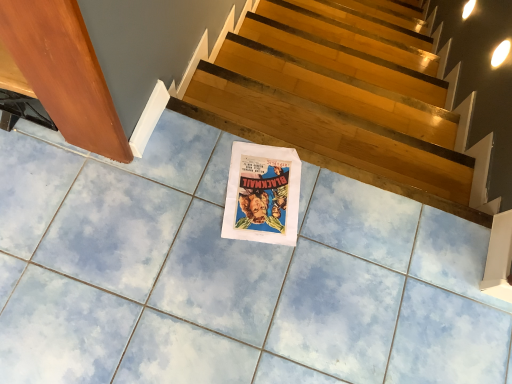
This screenshot has width=512, height=384. What do you see at coordinates (341, 96) in the screenshot? I see `wooden at upper center` at bounding box center [341, 96].

This screenshot has width=512, height=384. In order to click on wooden at upper center in this screenshot , I will do `click(341, 96)`.

At what (x,y) coordinates should I click in order to perform the action: click on white paper at center. Please return your answer as a coordinate pair (x, y). The image size is (512, 384). Looking at the image, I should click on (262, 194).

Measure the distance between point [289,227] and camera.

Point [289,227] is 1.19 meters away from camera.

What do you see at coordinates (262, 194) in the screenshot?
I see `white paper at center` at bounding box center [262, 194].

Locate an element on the screen. wooden at upper center is located at coordinates (341, 96).

Based on their positions, is white paper at center located to the left or right of wooden at upper center?

In the image, white paper at center appears on the left side of wooden at upper center.

Is white paper at center further to camera compared to wooden at upper center?

No, white paper at center is closer to the camera.

Which point is more distant from viewer, (247, 208) or (457, 114)?

The point (457, 114) is behind.

From the image's perspective, is white paper at center above wooden at upper center?

No, from the image's perspective, white paper at center is not on top of wooden at upper center.

From a real-world perspective, which is physically below, white paper at center or wooden at upper center?

wooden at upper center, from a real-world perspective.

Considering the relative sizes of white paper at center and wooden at upper center in the image provided, is white paper at center thinner than wooden at upper center?

No, white paper at center is not thinner than wooden at upper center.

Considering the sizes of white paper at center and wooden at upper center in the image, is white paper at center taller or shorter than wooden at upper center?

Clearly, white paper at center is shorter compared to wooden at upper center.

In the scene shown: Considering the relative sizes of white paper at center and wooden at upper center in the image provided, is white paper at center smaller than wooden at upper center?

Yes.

Is wooden at upper center located within white paper at center?

No, wooden at upper center is located outside of white paper at center.

Is white paper at center beside wooden at upper center?

No, white paper at center is not beside wooden at upper center.

Is white paper at center turned away from wooden at upper center?

white paper at center is not turned away from wooden at upper center.

From the picture: What's the angular difference between white paper at center and wooden at upper center's facing directions?

There is a 14.6-degree angle between the facing directions of white paper at center and wooden at upper center.

Where is `stairs that is under the white paper at center (from a real-world perspective)`? stairs that is under the white paper at center (from a real-world perspective) is located at coordinates (341, 96).

Does wooden at upper center appear on the right side of white paper at center?

Correct, you'll find wooden at upper center to the right of white paper at center.

Relative to white paper at center, is wooden at upper center in front or behind?

Visually, wooden at upper center is located behind white paper at center.

Which is in front, point (396, 78) or point (256, 225)?

The point (256, 225) is closer.

In the scene shown: From the image's perspective, is wooden at upper center above white paper at center?

Yes, from the image's perspective, wooden at upper center is on top of white paper at center.

From a real-world perspective, between wooden at upper center and white paper at center, who is vertically higher?

→ white paper at center is physically above.

Between wooden at upper center and white paper at center, which one has larger width?

white paper at center.

Is wooden at upper center taller than white paper at center?

Correct, wooden at upper center is much taller as white paper at center.

Does wooden at upper center have a smaller size compared to white paper at center?

No.

Is wooden at upper center inside or outside of white paper at center?

wooden at upper center is located beyond the bounds of white paper at center.

Would you say wooden at upper center is a long distance from white paper at center?

wooden at upper center is near white paper at center, not far away.

Could you tell me if wooden at upper center is facing white paper at center?

No, wooden at upper center is not aimed at white paper at center.

What's the angular difference between wooden at upper center and white paper at center's facing directions?

They differ by 14.6 degrees in their facing directions.

Where is `stairs above the white paper at center (from the image's perspective)`? The height and width of the screenshot is (384, 512). stairs above the white paper at center (from the image's perspective) is located at coordinates (341, 96).

Find the location of a particular element. Image resolution: width=512 pixels, height=384 pixels. movie poster below the wooden at upper center (from the image's perspective) is located at coordinates (262, 194).

The height and width of the screenshot is (384, 512). Identify the location of movie poster that is in front of the wooden at upper center. click(x=262, y=194).